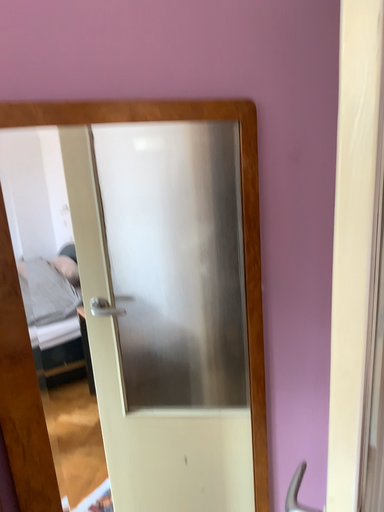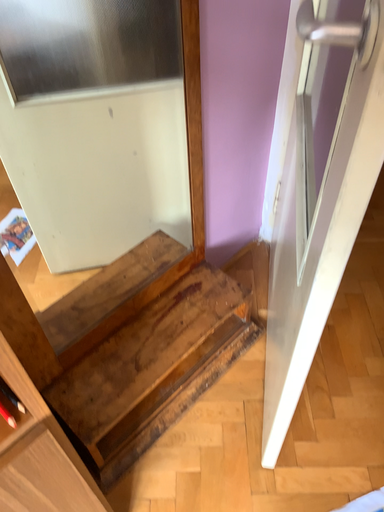
Question: How did the camera likely rotate when shooting the video?

Choices:
 (A) rotated downward
 (B) rotated upward

Answer: (A)